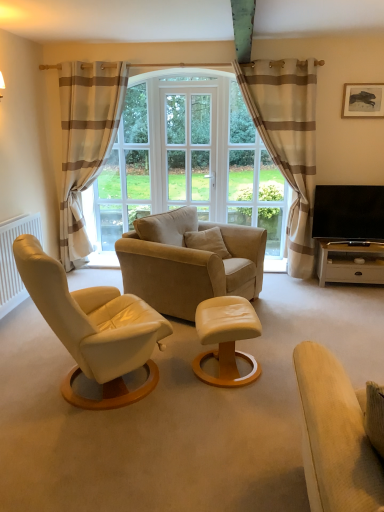
This screenshot has height=512, width=384. In order to click on free location in front of matte leather ottoman at center, which is the 1th table from bottom to top in this screenshot , I will do `click(230, 410)`.